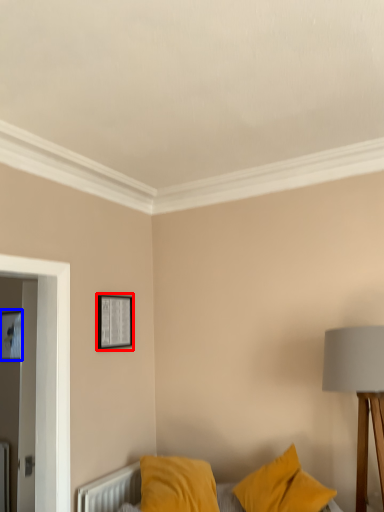
Question: Among these objects, which one is farthest to the camera, picture frame (highlighted by a red box) or picture frame (highlighted by a blue box)?

Choices:
 (A) picture frame
 (B) picture frame

Answer: (B)